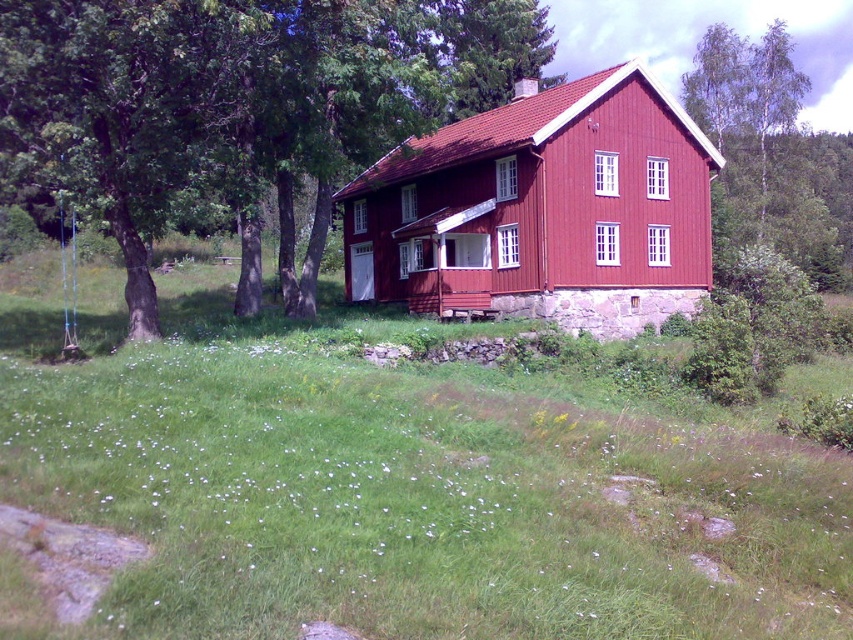
Question: Which object appears farthest from the camera in this image?

Choices:
 (A) green leafy tree at center
 (B) matte red wooden cabin at center

Answer: (B)

Question: Which point appears farthest from the camera in this image?

Choices:
 (A) (349, 275)
 (B) (265, 124)

Answer: (A)

Question: Is green leafy tree at center thinner than matte red wooden cabin at center?

Choices:
 (A) yes
 (B) no

Answer: (B)

Question: Which point appears closest to the camera in this image?

Choices:
 (A) (260, 28)
 (B) (560, 241)

Answer: (A)

Question: Does green leafy tree at center appear on the right side of matte red wooden cabin at center?

Choices:
 (A) yes
 (B) no

Answer: (B)

Question: Does green leafy tree at center come behind matte red wooden cabin at center?

Choices:
 (A) yes
 (B) no

Answer: (B)